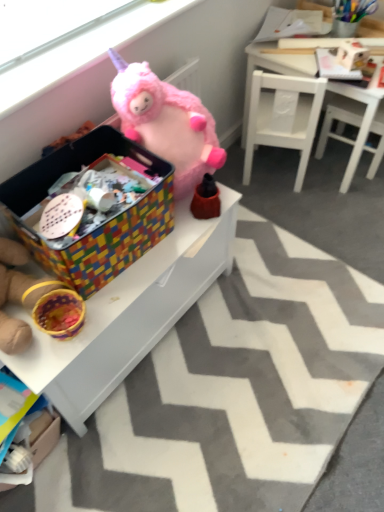
The height and width of the screenshot is (512, 384). Identify the location of vacant area on top of white painted wood table at center, which is the second table in top-to-bottom order (from a real-world perspective). (129, 276).